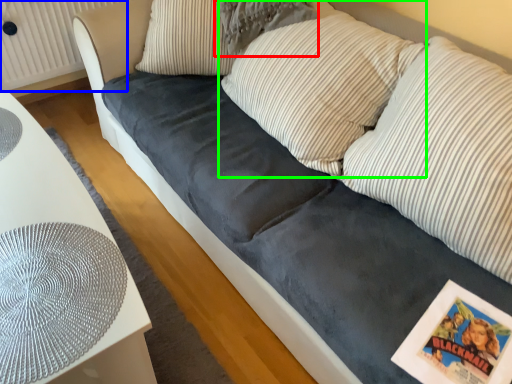
Question: Which is nearer to the pillow (highlighted by a red box)? radiator (highlighted by a blue box) or pillow (highlighted by a green box).

Choices:
 (A) radiator
 (B) pillow

Answer: (B)